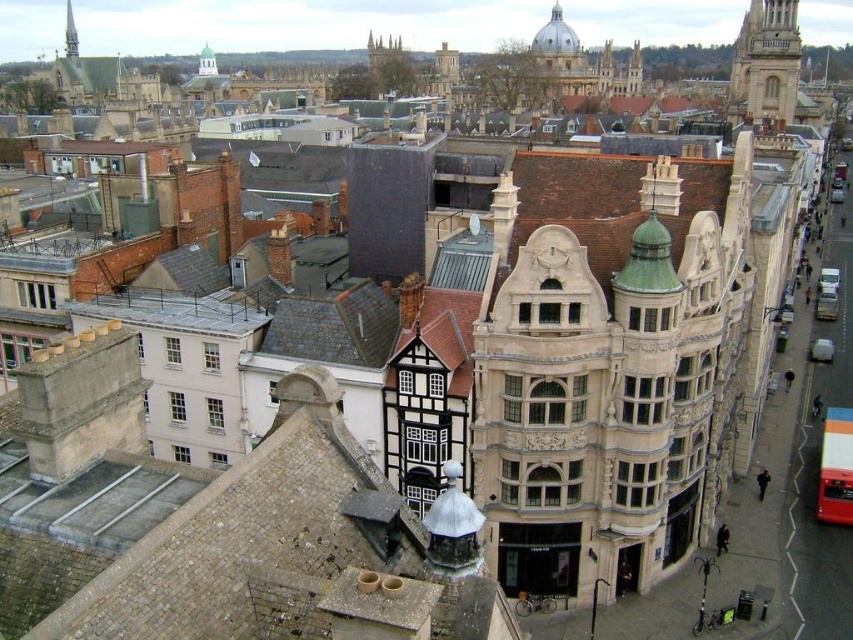
You are standing on the rooftop of the beige stone building at center and want to take a photo of the stone tower at upper right. Which direction should you face to capture the tower in your view?

Since the beige stone building at center is located below the stone tower at upper right, you should face upward or towards the upper right direction to capture the stone tower at upper right in your view.

You are standing at the base of the tower from which the panoramic view was taken. You want to locate the beige stone building at center. What are its coordinates in the image?

The beige stone building at center is located at coordinates point (606, 362).